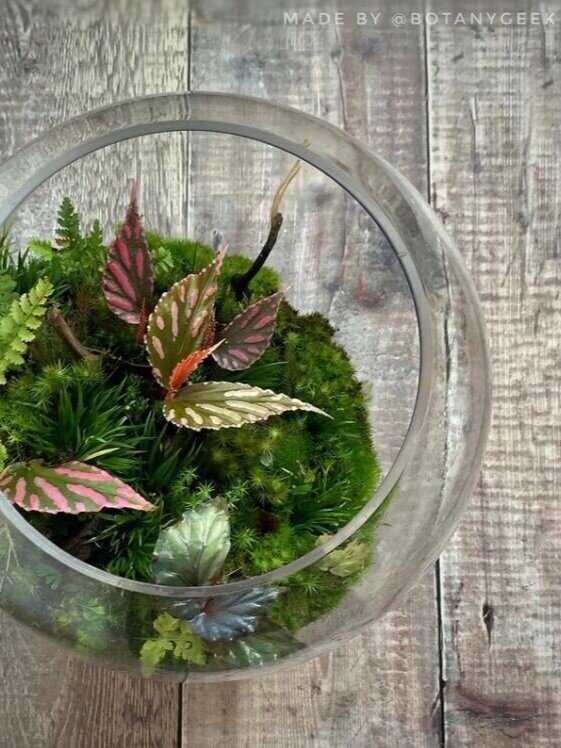
Locate an element on the screen. This screenshot has width=561, height=748. three wood vertical planks is located at coordinates (135, 717), (246, 714), (502, 692).